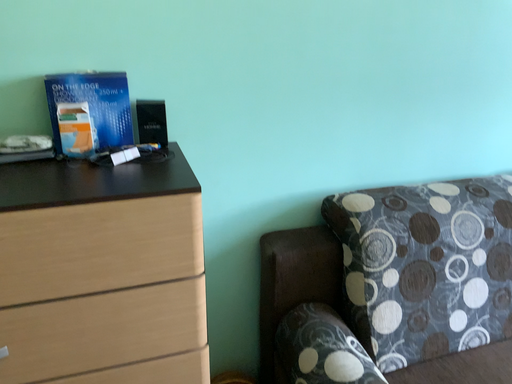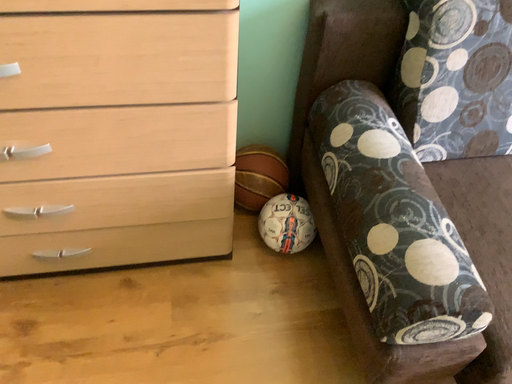
Question: Which way did the camera rotate in the video?

Choices:
 (A) rotated right
 (B) rotated left

Answer: (B)